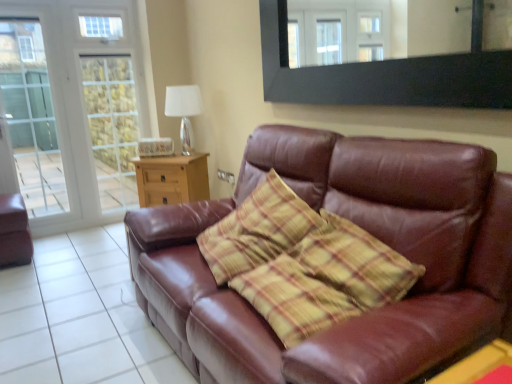
At what (x,y) coordinates should I click in order to perform the action: click on brown leather couch at lower right. Please return your answer as a coordinate pair (x, y). The image size is (512, 384). Looking at the image, I should click on (80, 316).

The height and width of the screenshot is (384, 512). What are the coordinates of `black matte mirror at upper center` in the screenshot? It's located at (382, 75).

Identify the location of brown leather couch at center. The width and height of the screenshot is (512, 384). (361, 227).

You are a GUI agent. You are given a task and a screenshot of the screen. Output one action in this format:
    pyautogui.click(x=<x>, y=<y>)
    Task: Click on the transparent glass door at left
    The width and height of the screenshot is (512, 384).
    Given the screenshot: What is the action you would take?
    pyautogui.click(x=72, y=108)

The width and height of the screenshot is (512, 384). What do you see at coordinates (14, 231) in the screenshot? I see `matte brown leather armchair at left` at bounding box center [14, 231].

The width and height of the screenshot is (512, 384). Describe the element at coordinates (172, 179) in the screenshot. I see `wooden side table at center, which is the 1th table in top-to-bottom order` at that location.

You are a GUI agent. You are given a task and a screenshot of the screen. Output one action in this format:
    pyautogui.click(x=<x>, y=<y>)
    Task: Click on the clear glass screen door at left
    The width and height of the screenshot is (512, 384).
    Given the screenshot: What is the action you would take?
    pyautogui.click(x=31, y=117)

Is black matte mirror at upper center situated inside yellow plastic table at lower right, the first table viewed from the right, or outside?

black matte mirror at upper center lies outside yellow plastic table at lower right, the first table viewed from the right.

From the image's perspective, which object appears higher, black matte mirror at upper center or yellow plastic table at lower right, the first table viewed from the right?

black matte mirror at upper center.

Considering the sizes of black matte mirror at upper center and yellow plastic table at lower right, arranged as the 2th table when viewed from the back, in the image, is black matte mirror at upper center bigger or smaller than yellow plastic table at lower right, arranged as the 2th table when viewed from the back,?

In the image, black matte mirror at upper center appears to be larger than yellow plastic table at lower right, arranged as the 2th table when viewed from the back.

Based on the photo, is black matte mirror at upper center wider or thinner than yellow plastic table at lower right, positioned as the 2th table in top-to-bottom order?

Considering their sizes, black matte mirror at upper center looks slimmer than yellow plastic table at lower right, positioned as the 2th table in top-to-bottom order.

Considering the positions of objects transparent glass door at left and clear glass screen door at left in the image provided, who is more to the right, transparent glass door at left or clear glass screen door at left?

Positioned to the right is transparent glass door at left.

What are the coordinates of `screen door that is in front of the transparent glass door at left` in the screenshot? It's located at (31, 117).

From a real-world perspective, which object rests below the other?

clear glass screen door at left.

From the picture: Which object is closer to the camera taking this photo, transparent glass door at left or clear glass screen door at left?

clear glass screen door at left.

Could you tell me if yellow plastic table at lower right, placed as the 1th table when sorted from front to back, is turned towards wooden side table at center, arranged as the first table when viewed from the left?

No, yellow plastic table at lower right, placed as the 1th table when sorted from front to back, is not oriented towards wooden side table at center, arranged as the first table when viewed from the left.

From a real-world perspective, who is located lower, yellow plastic table at lower right, placed as the 1th table when sorted from front to back, or wooden side table at center, positioned as the second table in right-to-left order?

From a 3D spatial view, wooden side table at center, positioned as the second table in right-to-left order, is below.

Find the location of a particular element. Image resolution: width=512 pixels, height=384 pixels. table that is above the wooden side table at center, the first table in the back-to-front sequence (from a real-world perspective) is located at coordinates (477, 364).

Which of these two, transparent glass door at left or brown leather couch at center, is wider?

With larger width is brown leather couch at center.

From a real-world perspective, which object stands above the other?

In real-world perspective, transparent glass door at left is above.

Can you confirm if transparent glass door at left is shorter than brown leather couch at center?

No, transparent glass door at left is not shorter than brown leather couch at center.

The height and width of the screenshot is (384, 512). I want to click on tile that is below the transparent glass door at left (from the image's perspective), so click(x=80, y=316).

In the scene shown: From the image's perspective, is transparent glass door at left on top of brown leather couch at lower right?

Correct, transparent glass door at left appears higher than brown leather couch at lower right in the image.

From a real-world perspective, is transparent glass door at left positioned over brown leather couch at lower right based on gravity?

Yes, from a real-world perspective, transparent glass door at left is on top of brown leather couch at lower right.

Is the position of transparent glass door at left more distant than that of brown leather couch at lower right?

Yes, the depth of transparent glass door at left is greater than that of brown leather couch at lower right.

Considering the relative sizes of yellow plastic table at lower right, positioned as the 2th table in top-to-bottom order, and brown leather couch at lower right in the image provided, is yellow plastic table at lower right, positioned as the 2th table in top-to-bottom order, taller than brown leather couch at lower right?

In fact, yellow plastic table at lower right, positioned as the 2th table in top-to-bottom order, may be shorter than brown leather couch at lower right.

Find the location of `the 2nd table directly above the brown leather couch at lower right (from a real-world perspective)`. the 2nd table directly above the brown leather couch at lower right (from a real-world perspective) is located at coordinates (477, 364).

Is the surface of yellow plastic table at lower right, the first table viewed from the right, in direct contact with brown leather couch at lower right?

yellow plastic table at lower right, the first table viewed from the right, and brown leather couch at lower right are clearly separated.

Can you tell me how much yellow plastic table at lower right, positioned as the 2th table in top-to-bottom order, and brown leather couch at lower right differ in facing direction?

yellow plastic table at lower right, positioned as the 2th table in top-to-bottom order, and brown leather couch at lower right are facing 1.66 degrees away from each other.

From the image's perspective, is clear glass screen door at left positioned above or below black matte mirror at upper center?

clear glass screen door at left is below black matte mirror at upper center.

The width and height of the screenshot is (512, 384). I want to click on mirror to the right of clear glass screen door at left, so click(x=382, y=75).

Which of these two, clear glass screen door at left or black matte mirror at upper center, is bigger?

With larger size is clear glass screen door at left.

Find the location of a particular element. The width and height of the screenshot is (512, 384). mirror above the yellow plastic table at lower right, positioned as the 2th table in top-to-bottom order (from the image's perspective) is located at coordinates (382, 75).

Identify the location of screen door below the transparent glass door at left (from a real-world perspective). The image size is (512, 384). (31, 117).

Which object lies nearer to the anchor point yellow plastic table at lower right, which is the 1th table from bottom to top, black matte mirror at upper center or clear glass screen door at left?

Among the two, black matte mirror at upper center is located nearer to yellow plastic table at lower right, which is the 1th table from bottom to top.

Considering their positions, is brown leather couch at lower right positioned closer to matte brown leather armchair at left than white glass lamp at upper center?

brown leather couch at lower right is positioned closer to the anchor matte brown leather armchair at left.

From the image, which object appears to be farther from clear glass screen door at left, wooden side table at center, the 2th table when ordered from bottom to top, or black matte mirror at upper center?

Among the two, black matte mirror at upper center is located further to clear glass screen door at left.

Estimate the real-world distances between objects in this image. Which object is closer to transparent glass door at left, matte brown leather armchair at left or wooden side table at center, the 2th table positioned from the front?

The object closer to transparent glass door at left is wooden side table at center, the 2th table positioned from the front.

From the image, which object appears to be nearer to yellow plastic table at lower right, which is the 1th table from bottom to top, wooden side table at center, positioned as the second table in right-to-left order, or white glass lamp at upper center?

wooden side table at center, positioned as the second table in right-to-left order, is closer to yellow plastic table at lower right, which is the 1th table from bottom to top.

Considering their positions, is brown leather couch at lower right positioned closer to transparent glass door at left than black matte mirror at upper center?

Among the two, brown leather couch at lower right is located nearer to transparent glass door at left.

Which object lies further to the anchor point matte brown leather armchair at left, brown leather couch at lower right or black matte mirror at upper center?

black matte mirror at upper center is positioned further to the anchor matte brown leather armchair at left.

Estimate the real-world distances between objects in this image. Which object is further from transparent glass door at left, wooden side table at center, the first table in the back-to-front sequence, or yellow plastic table at lower right, which is the 1th table from bottom to top?

Based on the image, yellow plastic table at lower right, which is the 1th table from bottom to top, appears to be further to transparent glass door at left.

In order to click on table between brown leather couch at lower right and white glass lamp at upper center from front to back in this screenshot , I will do `click(172, 179)`.

This screenshot has height=384, width=512. Find the location of `table between clear glass screen door at left and white glass lamp at upper center`. table between clear glass screen door at left and white glass lamp at upper center is located at coordinates (172, 179).

Image resolution: width=512 pixels, height=384 pixels. I want to click on screen door between brown leather couch at lower right and wooden side table at center, the 2th table when ordered from bottom to top, in the front-back direction, so click(31, 117).

Identify the location of table between brown leather couch at lower right and transparent glass door at left from front to back. (172, 179).